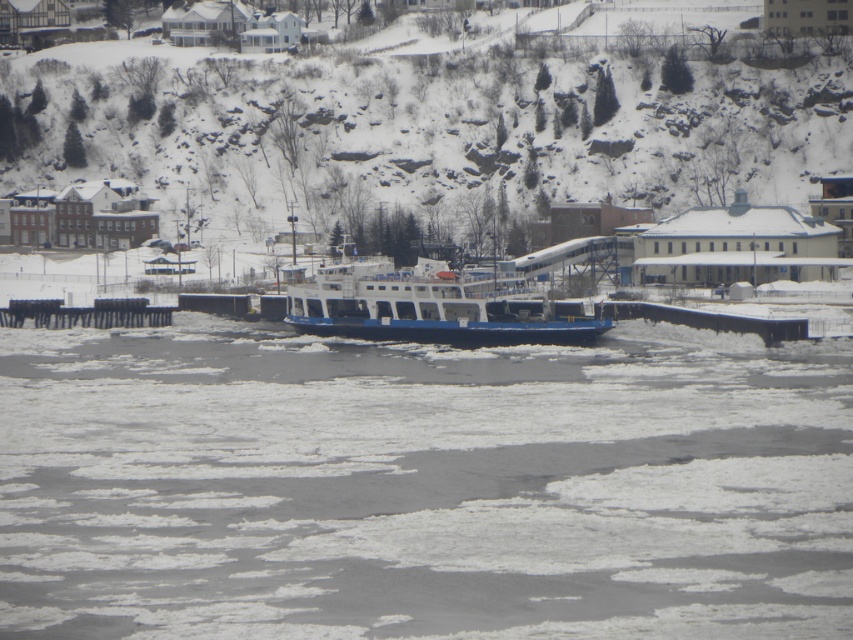
Which is more to the right, white ice at center or blue matte ferry at center?

From the viewer's perspective, blue matte ferry at center appears more on the right side.

Describe the element at coordinates (421, 484) in the screenshot. Image resolution: width=853 pixels, height=640 pixels. I see `white ice at center` at that location.

Identify the location of white ice at center. The width and height of the screenshot is (853, 640). (421, 484).

Does point (335, 128) come in front of point (387, 337)?

No, it is behind (387, 337).

Which is in front, point (384, 196) or point (433, 314)?

Positioned in front is point (433, 314).

The width and height of the screenshot is (853, 640). Find the location of `snowy rock at upper center`. snowy rock at upper center is located at coordinates (438, 120).

Between white ice at center and snowy rock at upper center, which one has less height?

white ice at center

Is white ice at center shorter than snowy rock at upper center?

Yes, white ice at center is shorter than snowy rock at upper center.

The image size is (853, 640). In order to click on white ice at center in this screenshot , I will do `click(421, 484)`.